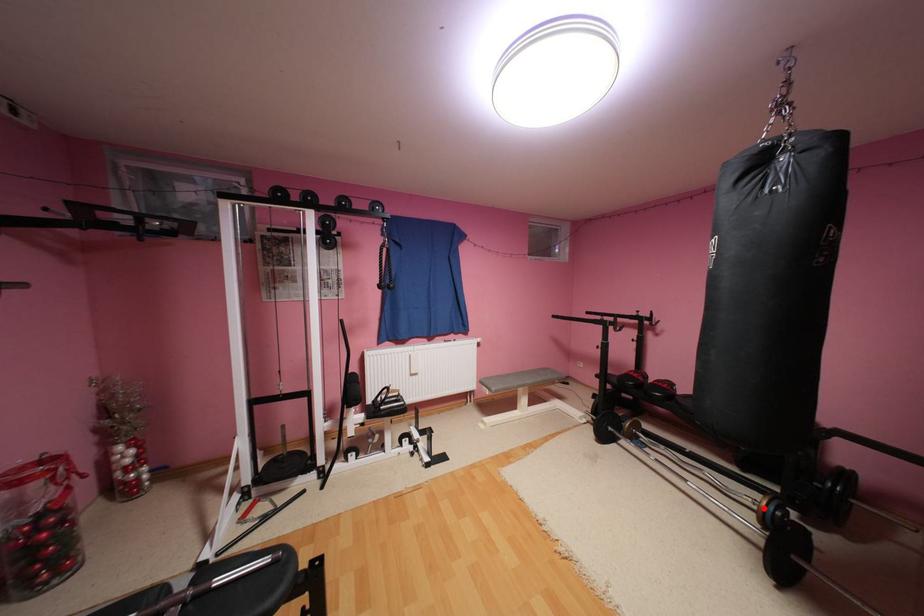
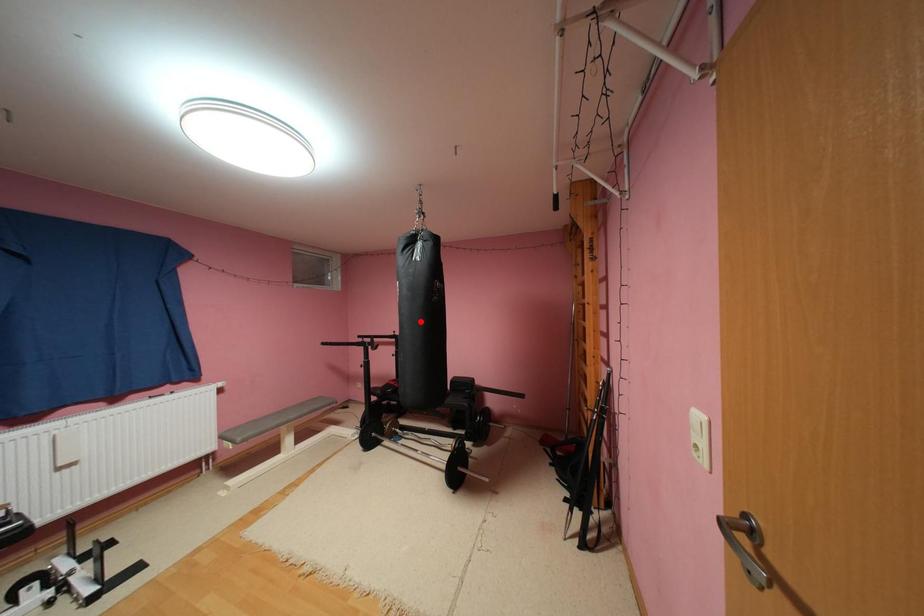
I am providing you with two images of the same scene from different viewpoints. A red point is marked on the first image and another point is marked on the second image. Is the red point in image1 aligned with the point shown in image2?

No